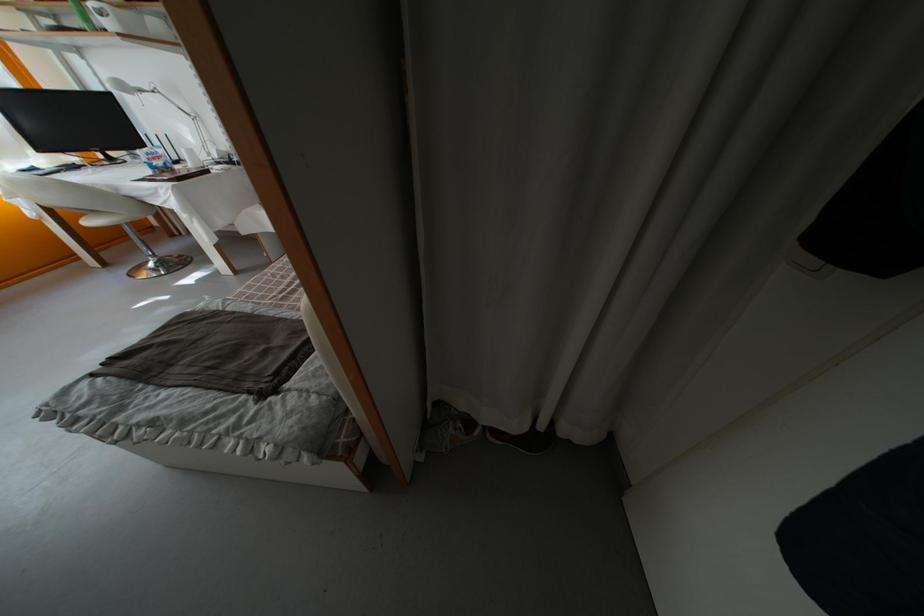
Image resolution: width=924 pixels, height=616 pixels. What are the coordinates of `plastic water bottle` in the screenshot? It's located at (155, 160).